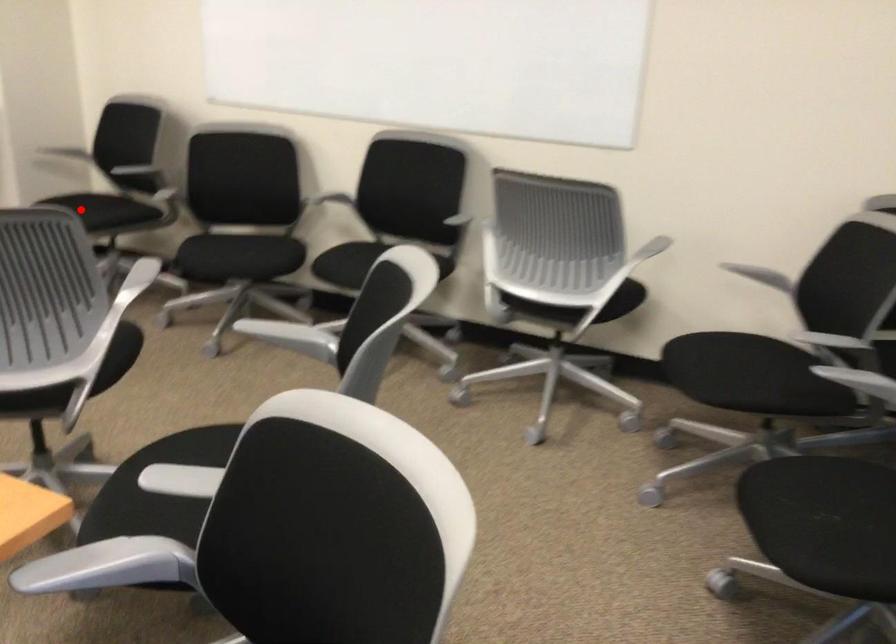
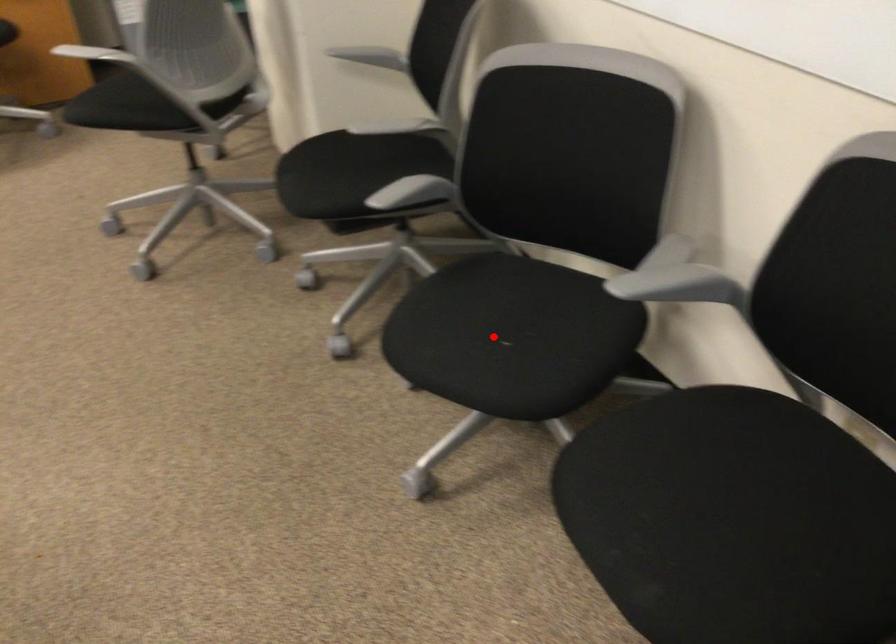
I am providing you with two images of the same scene from different viewpoints. A red point is marked on the first image and another point is marked on the second image. Are the points marked in image1 and image2 representing the same 3D position?

No